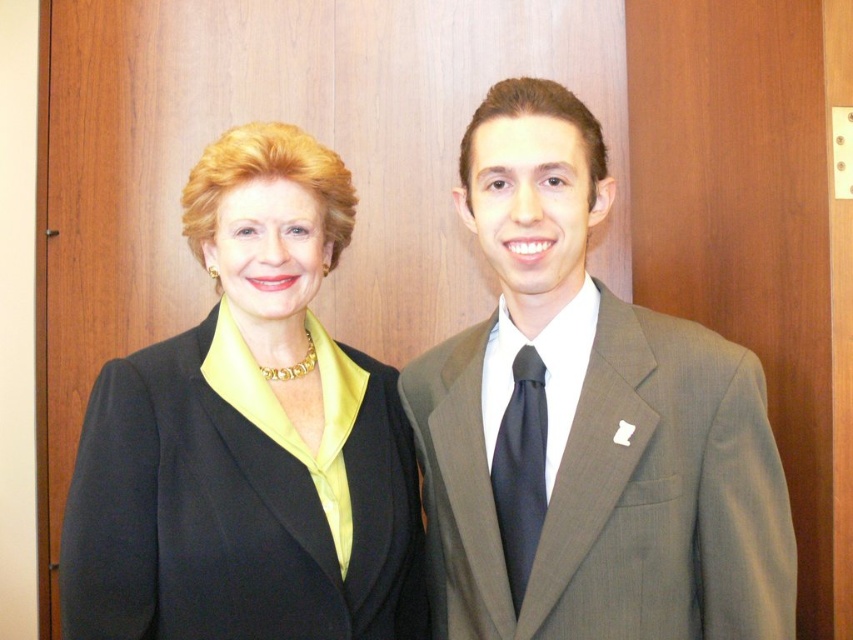
You are a tailor who needs to determine which item requires more fabric for alterations between the matte gray suit at center and the black satin tie at center. Based on their sizes, which one would need more fabric?

The matte gray suit at center is larger in size than the black satin tie at center, so it would require more fabric for alterations.

You are a tailor who needs to adjust the black matte suit at left and the black satin tie at center. Which item requires more fabric to accommodate a larger size?

The black matte suit at left requires more fabric because its width is larger than the black satin tie at center.

You are taking a photo of two people standing against a wooden wall. You notice two points marked at coordinates point (x=442, y=560) and point (x=509, y=552). Which point is closer to the camera?

Point (x=442, y=560) is further to the camera than point (x=509, y=552), so the closer point to the camera is point (x=509, y=552).